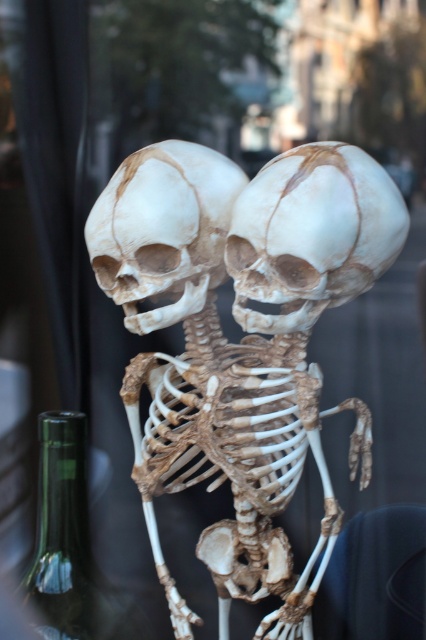
Is brown textured skeleton at center shorter than smooth beige skull at center?

Incorrect, brown textured skeleton at center's height does not fall short of smooth beige skull at center's.

Image resolution: width=426 pixels, height=640 pixels. What do you see at coordinates (241, 342) in the screenshot?
I see `brown textured skeleton at center` at bounding box center [241, 342].

The height and width of the screenshot is (640, 426). I want to click on brown textured skeleton at center, so click(241, 342).

Is brown textured skeleton at center taller than white matte skull at center?

Correct, brown textured skeleton at center is much taller as white matte skull at center.

This screenshot has width=426, height=640. What are the coordinates of `brown textured skeleton at center` in the screenshot? It's located at (241, 342).

Identify the location of brown textured skeleton at center. The image size is (426, 640). point(241,342).

Looking at this image, can you confirm if smooth beige skull at center is positioned to the left of green glass bottle at lower left?

In fact, smooth beige skull at center is to the right of green glass bottle at lower left.

Can you confirm if smooth beige skull at center is smaller than green glass bottle at lower left?

Indeed, smooth beige skull at center has a smaller size compared to green glass bottle at lower left.

Between point (126, 304) and point (57, 625), which one is positioned behind?

Point (57, 625)

At what (x,y) coordinates should I click in order to perform the action: click on smooth beige skull at center. Please return your answer as a coordinate pair (x, y). Looking at the image, I should click on tap(163, 228).